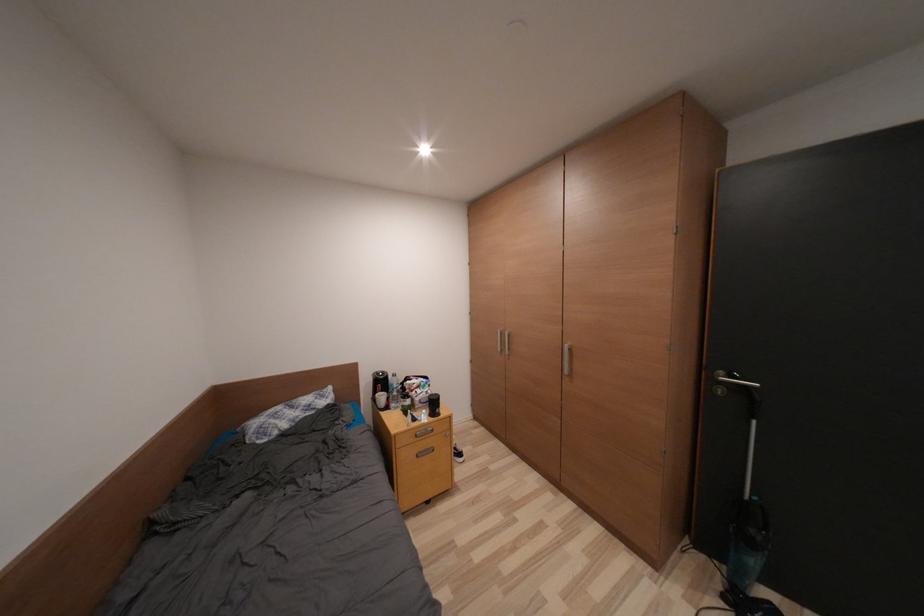
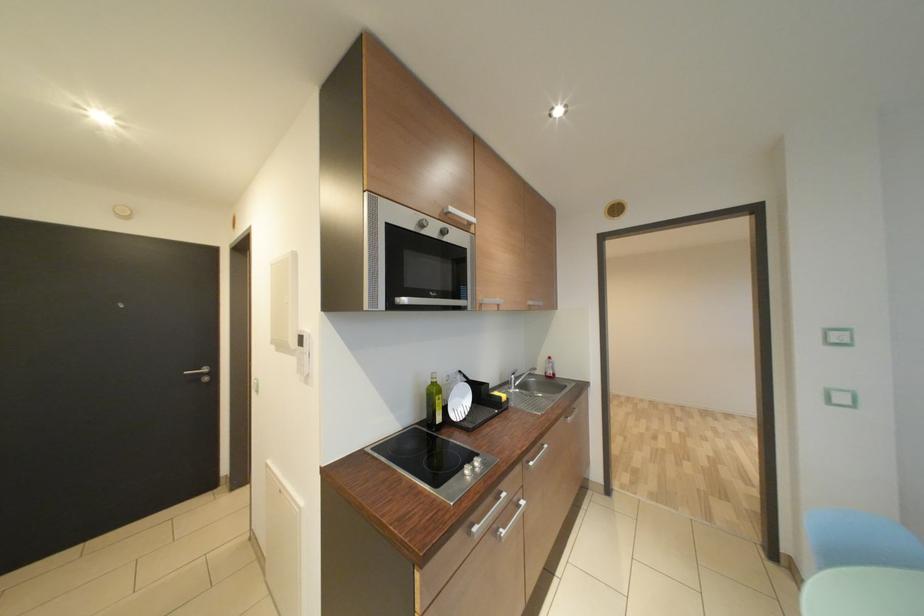
Question: What movement of the cameraman would produce the second image?

Choices:
 (A) Left
 (B) Right
 (C) Forward
 (D) Backward

Answer: (B)